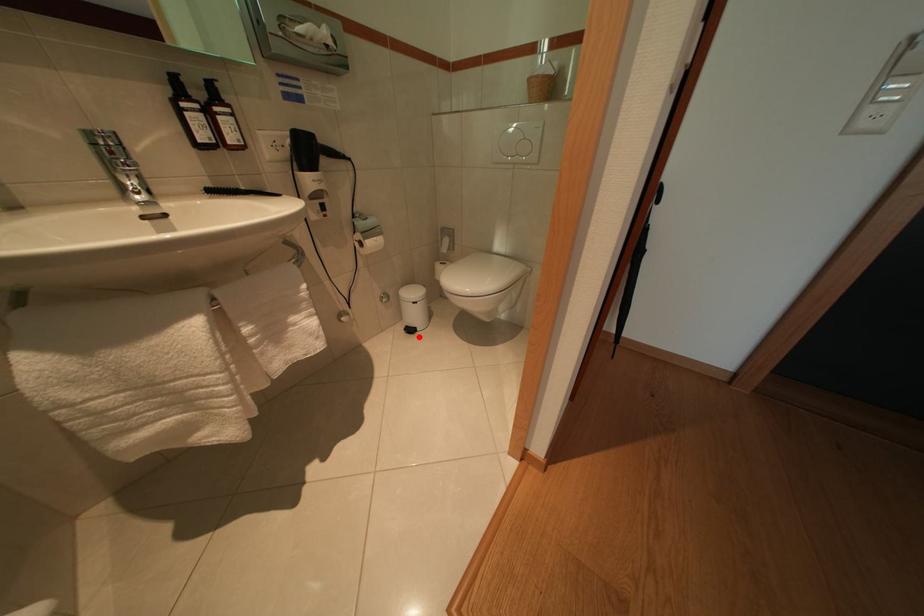
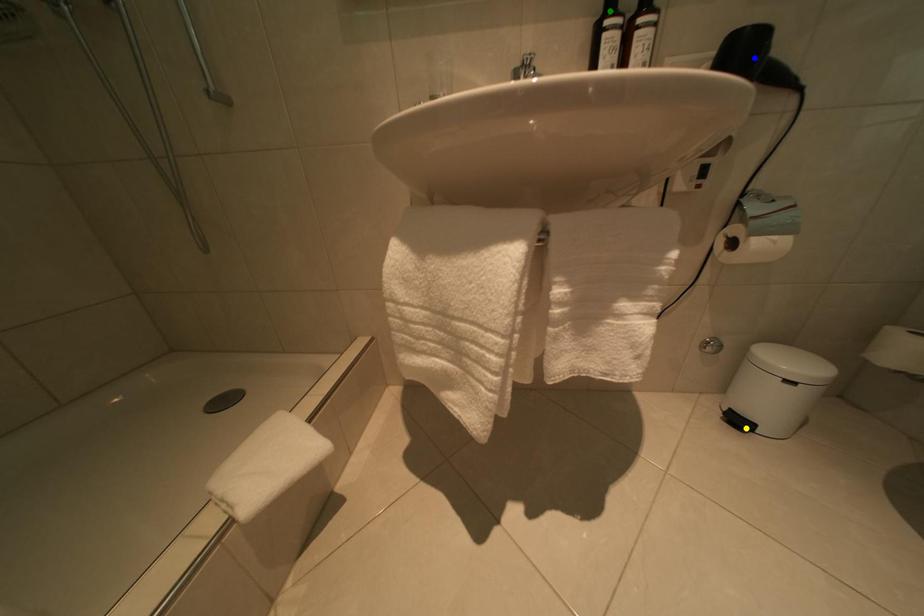
Question: I am providing you with two images of the same scene from different viewpoints. A red point is marked on the first image. You are given multiple points on the second image. Which point in image 2 represents the same 3d spot as the red point in image 1?

Choices:
 (A) blue point
 (B) green point
 (C) yellow point

Answer: (C)